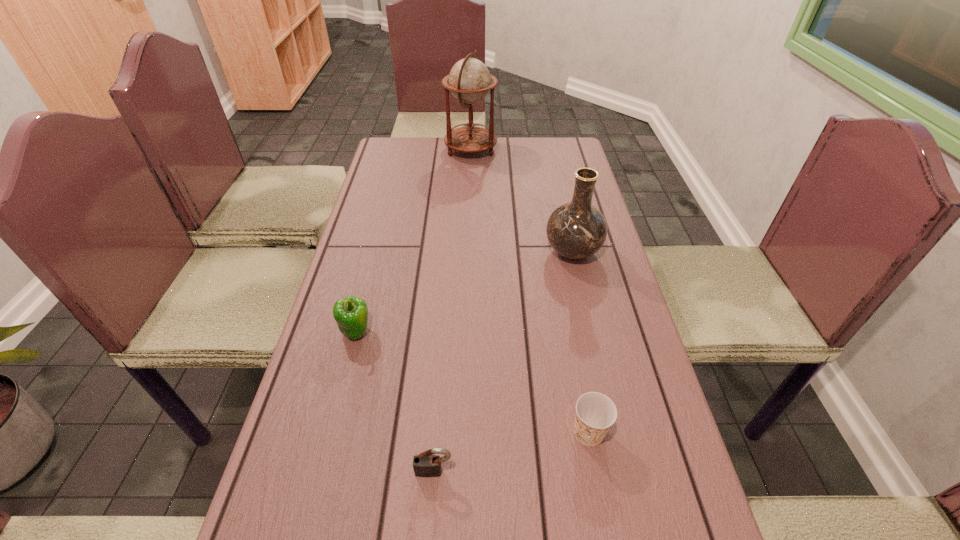
You are a GUI agent. You are given a task and a screenshot of the screen. Output one action in this format:
    pyautogui.click(x=<x>, y=<y>)
    Task: Click on the tallest object
    
    Given the screenshot: What is the action you would take?
    pos(469,80)

The height and width of the screenshot is (540, 960). Identify the location of the farthest object. (469, 80).

Locate an element on the screen. This screenshot has height=540, width=960. the second farthest object is located at coordinates click(576, 230).

The image size is (960, 540). I want to click on vase, so click(576, 230).

Locate an element on the screen. bell pepper is located at coordinates (351, 313).

The image size is (960, 540). I want to click on the third nearest object, so click(351, 313).

The image size is (960, 540). Identify the location of Dixie cup. (595, 413).

Where is `the nearest object`? the nearest object is located at coordinates [x=425, y=464].

I want to click on vacant space positioned 0.290m on the surface of the farthest object, so pos(574,150).

I want to click on vacant area located on the back of the fourth nearest object, so click(x=564, y=214).